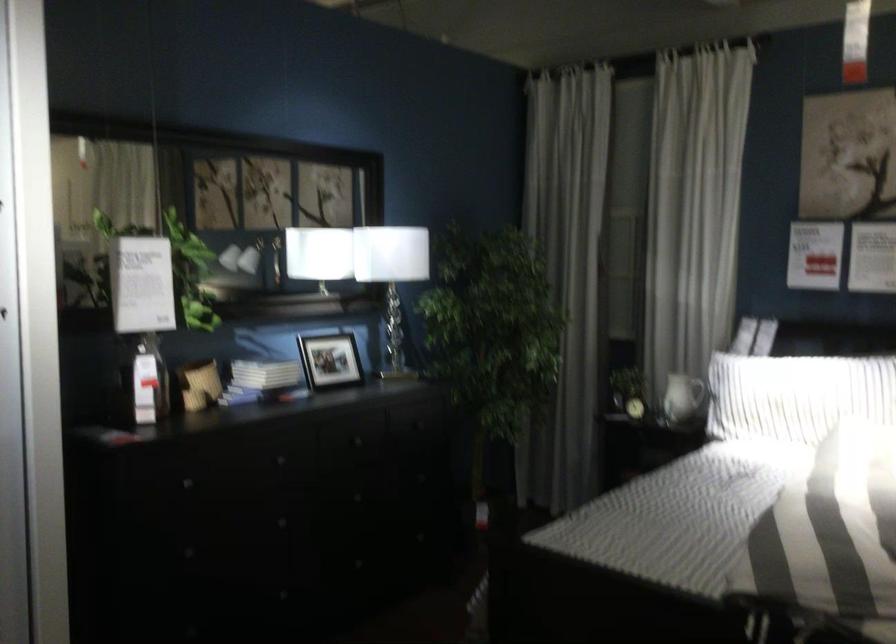
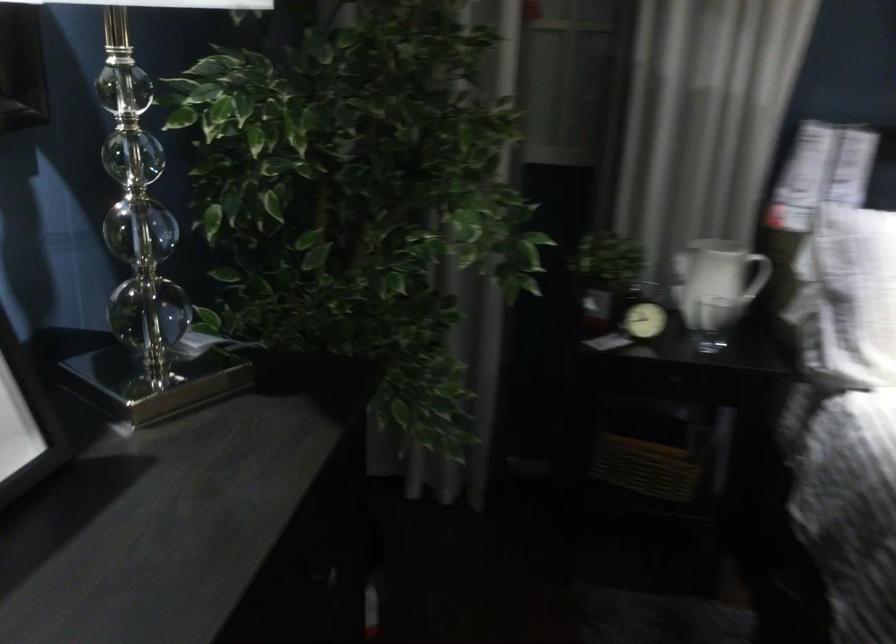
In the second image, find the point that corresponds to (x=627, y=377) in the first image.

(605, 275)